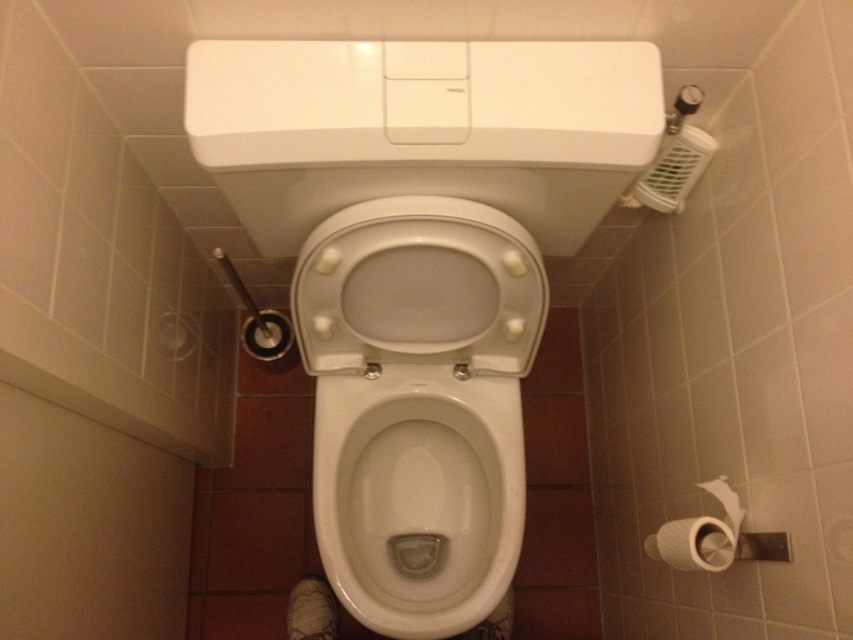
You are a cleaning robot with a width of 14 inches. You need to move from the white glossy toilet bowl at center to the white matte toilet paper at lower right. Can you fit through the space between them?

The distance between the white glossy toilet bowl at center and the white matte toilet paper at lower right is 14.15 inches. Since the robot is 14 inches wide, it can fit through the space as there is enough clearance.

You are a home inspector checking the bathroom layout. You need to ensure that the white glossy toilet bowl at center is positioned higher than the white matte toilet paper at lower right for accessibility. Based on the scene description, does the current arrangement meet this requirement?

Yes, the white glossy toilet bowl at center is taller than the white matte toilet paper at lower right, so the arrangement meets the accessibility requirement.